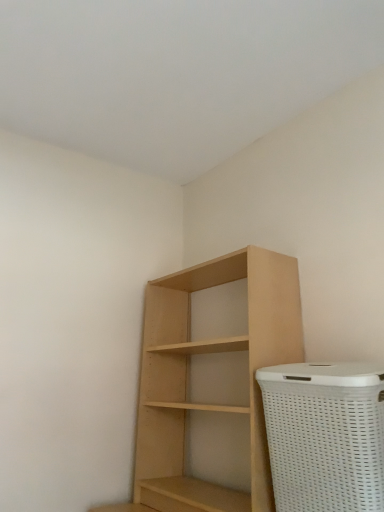
At what (x,y) coordinates should I click in order to perform the action: click on natural wood shelf at center. Please return your answer as a coordinate pair (x, y). Looking at the image, I should click on (187, 377).

The height and width of the screenshot is (512, 384). What do you see at coordinates (187, 377) in the screenshot?
I see `natural wood shelf at center` at bounding box center [187, 377].

What do you see at coordinates (325, 435) in the screenshot? The width and height of the screenshot is (384, 512). I see `white woven basket at lower right` at bounding box center [325, 435].

Locate an element on the screen. This screenshot has width=384, height=512. white woven basket at lower right is located at coordinates (325, 435).

Image resolution: width=384 pixels, height=512 pixels. What are the coordinates of `natural wood shelf at center` in the screenshot? It's located at click(187, 377).

Does white woven basket at lower right appear on the left side of natural wood shelf at center?

No, white woven basket at lower right is not to the left of natural wood shelf at center.

Between white woven basket at lower right and natural wood shelf at center, which one is positioned behind?

Positioned behind is natural wood shelf at center.

Is point (313, 484) positioned before point (158, 338)?

Yes, it is.

From the image's perspective, is white woven basket at lower right located above or below natural wood shelf at center?

Based on their image positions, white woven basket at lower right is located beneath natural wood shelf at center.

Based on the photo, from a real-world perspective, is white woven basket at lower right positioned above or below natural wood shelf at center?

white woven basket at lower right is situated lower than natural wood shelf at center in the real world.

From the picture: Which of these two, white woven basket at lower right or natural wood shelf at center, is wider?

Wider between the two is natural wood shelf at center.

Does white woven basket at lower right have a greater height compared to natural wood shelf at center?

No.

Is white woven basket at lower right bigger or smaller than natural wood shelf at center?

white woven basket at lower right is smaller than natural wood shelf at center.

In the scene shown: Is white woven basket at lower right spatially inside natural wood shelf at center, or outside of it?

white woven basket at lower right is spatially situated outside natural wood shelf at center.

Would you consider white woven basket at lower right to be distant from natural wood shelf at center?

Actually, white woven basket at lower right and natural wood shelf at center are a little close together.

Is white woven basket at lower right positioned with its back to natural wood shelf at center?

white woven basket at lower right is not turned away from natural wood shelf at center.

Where is `basket container in front of the natural wood shelf at center`? The width and height of the screenshot is (384, 512). basket container in front of the natural wood shelf at center is located at coordinates (325, 435).

Is natural wood shelf at center to the left of white woven basket at lower right from the viewer's perspective?

Yes.

Considering their positions, is natural wood shelf at center located in front of or behind white woven basket at lower right?

Clearly, natural wood shelf at center is behind white woven basket at lower right.

Which is less distant, (162, 420) or (342, 421)?

Point (162, 420) is positioned farther from the camera compared to point (342, 421).

From the image's perspective, relative to white woven basket at lower right, is natural wood shelf at center above or below?

From the image's perspective, natural wood shelf at center appears above white woven basket at lower right.

From a real-world perspective, who is located lower, natural wood shelf at center or white woven basket at lower right?

white woven basket at lower right, from a real-world perspective.

Is natural wood shelf at center thinner than white woven basket at lower right?

Incorrect, the width of natural wood shelf at center is not less than that of white woven basket at lower right.

Can you confirm if natural wood shelf at center is shorter than white woven basket at lower right?

No.

Between natural wood shelf at center and white woven basket at lower right, which one has larger size?

Bigger between the two is natural wood shelf at center.

Is natural wood shelf at center spatially inside white woven basket at lower right, or outside of it?

natural wood shelf at center exists outside the volume of white woven basket at lower right.

Does natural wood shelf at center touch white woven basket at lower right?

No, natural wood shelf at center is not touching white woven basket at lower right.

Is natural wood shelf at center facing towards white woven basket at lower right?

No, natural wood shelf at center does not turn towards white woven basket at lower right.

In the scene shown: Measure the distance between natural wood shelf at center and white woven basket at lower right.

16.23 inches.

Identify the location of basket container below the natural wood shelf at center (from a real-world perspective). The height and width of the screenshot is (512, 384). (325, 435).

The width and height of the screenshot is (384, 512). Find the location of `basket container that is under the natural wood shelf at center (from a real-world perspective)`. basket container that is under the natural wood shelf at center (from a real-world perspective) is located at coordinates point(325,435).

Find the location of `basket container in front of the natural wood shelf at center`. basket container in front of the natural wood shelf at center is located at coordinates (325, 435).